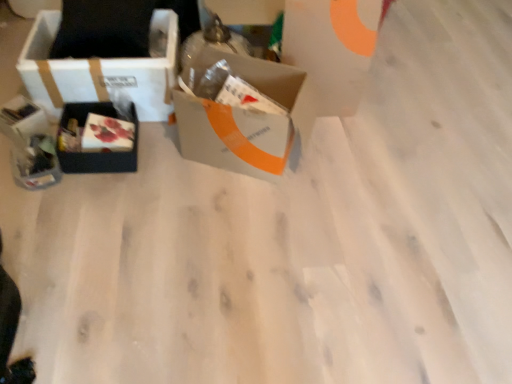
This screenshot has height=384, width=512. Identify the location of vacant area that lies between matte black box at left, the second box viewed from the left, and gray cardboard box at center, the first box positioned from the right. 175,164.